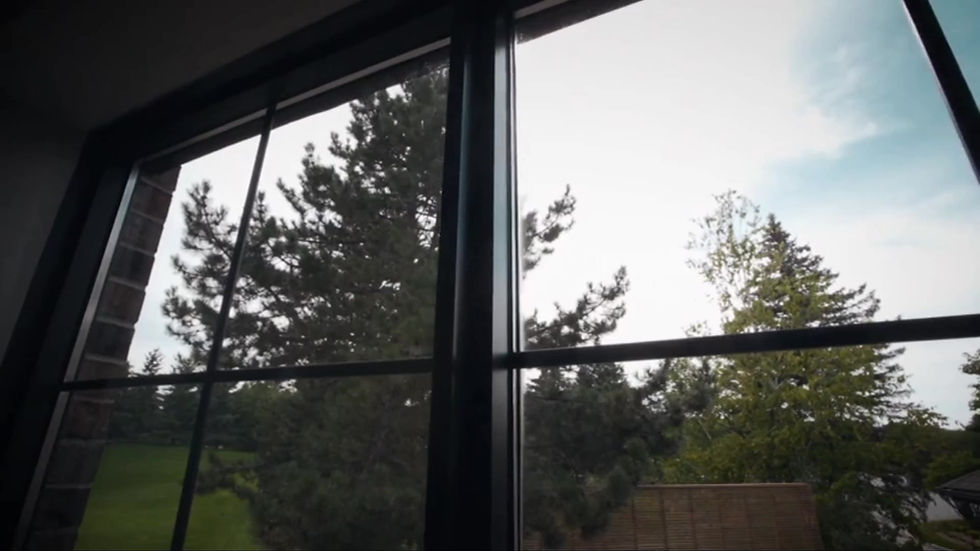
At what (x,y) coordinates should I click in order to perform the action: click on brick wall. Please return your answer as a coordinate pair (x, y). The height and width of the screenshot is (551, 980). Looking at the image, I should click on (126, 313).